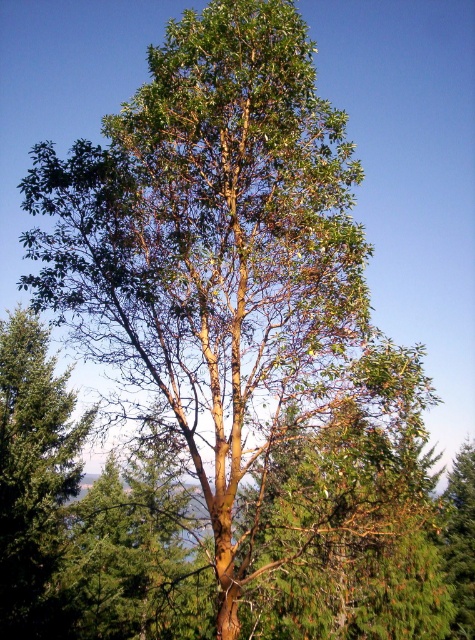
This screenshot has width=475, height=640. What do you see at coordinates (35, 480) in the screenshot?
I see `green matte tree at left` at bounding box center [35, 480].

Does point (26, 454) come farther from viewer compared to point (445, 538)?

No, (26, 454) is in front of (445, 538).

At what (x,y) coordinates should I click in order to perform the action: click on green matte tree at left. Please return your answer as a coordinate pair (x, y). Looking at the image, I should click on (35, 480).